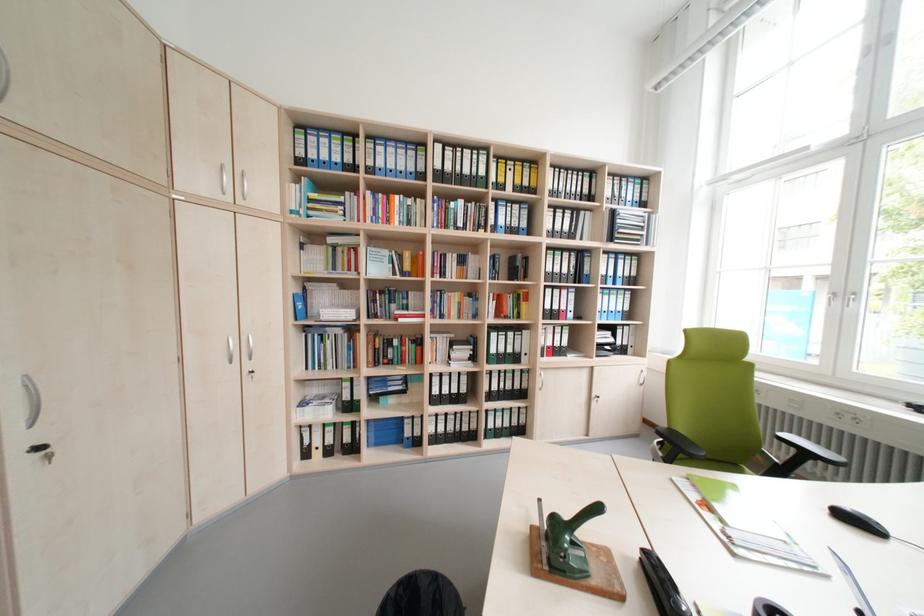
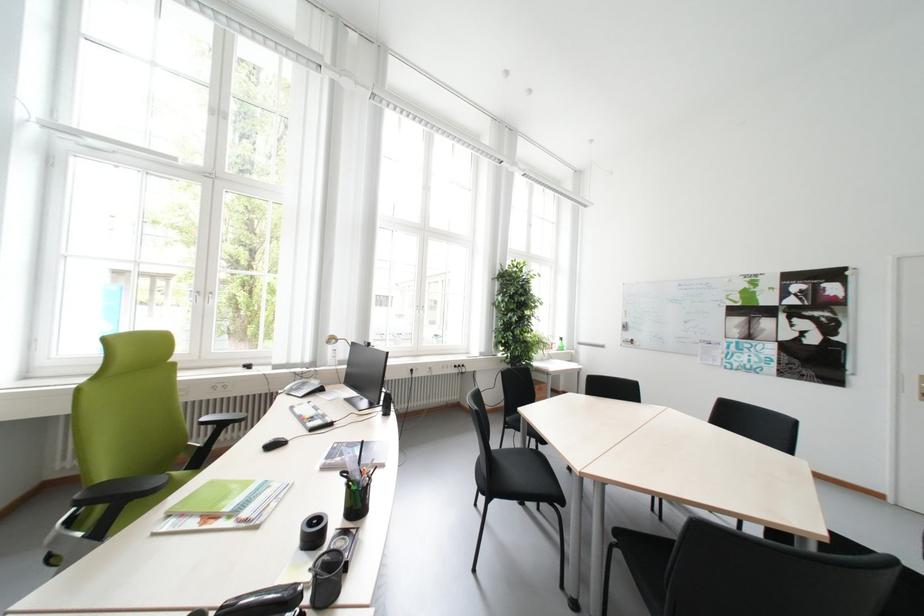
Locate, in the second image, the point that corresponds to the point at 857,508 in the first image.

(277, 442)